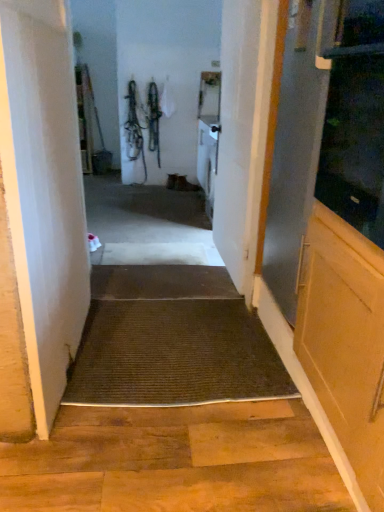
Image resolution: width=384 pixels, height=512 pixels. Find the location of `transparent glass screen door at right, placed as the second screen door when sorted from front to back`. transparent glass screen door at right, placed as the second screen door when sorted from front to back is located at coordinates (294, 156).

In order to click on brown textured mat at center, which is the second doormat in back-to-front order in this screenshot , I will do `click(174, 355)`.

Image resolution: width=384 pixels, height=512 pixels. What are the coordinates of `transparent glass screen door at right, placed as the second screen door when sorted from front to back` in the screenshot? It's located at click(x=294, y=156).

How far apart are brown textured mat at center, which is the second doormat in back-to-front order, and brown textured mat at center, placed as the 2th doormat when sorted from front to back?

The distance of brown textured mat at center, which is the second doormat in back-to-front order, from brown textured mat at center, placed as the 2th doormat when sorted from front to back, is 19.08 inches.

Considering the sizes of brown textured mat at center, which is the second doormat in back-to-front order, and brown textured mat at center, the 2th doormat positioned from the bottom, in the image, is brown textured mat at center, which is the second doormat in back-to-front order, bigger or smaller than brown textured mat at center, the 2th doormat positioned from the bottom,?

In the image, brown textured mat at center, which is the second doormat in back-to-front order, appears to be larger than brown textured mat at center, the 2th doormat positioned from the bottom.

Is brown textured mat at center, arranged as the first doormat when viewed from the front, facing towards brown textured mat at center, the 1th doormat in the top-to-bottom sequence?

No, brown textured mat at center, arranged as the first doormat when viewed from the front, is not aimed at brown textured mat at center, the 1th doormat in the top-to-bottom sequence.

Considering the positions of objects brown textured mat at center, the second doormat when ordered from top to bottom, and brown textured mat at center, the 2th doormat positioned from the bottom, in the image provided, who is behind, brown textured mat at center, the second doormat when ordered from top to bottom, or brown textured mat at center, the 2th doormat positioned from the bottom,?

brown textured mat at center, the 2th doormat positioned from the bottom, is further from the camera.

From the image's perspective, which one is positioned higher, transparent glass screen door at right, which is the second screen door from back to front, or brown textured mat at center, which ranks as the first doormat in bottom-to-top order?

From the image's view, transparent glass screen door at right, which is the second screen door from back to front, is above.

Considering the relative sizes of transparent glass screen door at right, the first screen door when ordered from front to back, and brown textured mat at center, which is the second doormat in back-to-front order, in the image provided, is transparent glass screen door at right, the first screen door when ordered from front to back, wider than brown textured mat at center, which is the second doormat in back-to-front order,?

Incorrect, the width of transparent glass screen door at right, the first screen door when ordered from front to back, does not surpass that of brown textured mat at center, which is the second doormat in back-to-front order.

Is transparent glass screen door at right, which is the second screen door from back to front, beside brown textured mat at center, which is the second doormat in back-to-front order?

No, transparent glass screen door at right, which is the second screen door from back to front, is not beside brown textured mat at center, which is the second doormat in back-to-front order.

Can you confirm if brown textured mat at center, the first doormat when ordered from back to front, is positioned to the right of transparent glass screen door at right, the first screen door when ordered from front to back?

In fact, brown textured mat at center, the first doormat when ordered from back to front, is to the left of transparent glass screen door at right, the first screen door when ordered from front to back.

Is brown textured mat at center, the 1th doormat in the top-to-bottom sequence, positioned far away from transparent glass screen door at right, the first screen door when ordered from front to back?

Yes, brown textured mat at center, the 1th doormat in the top-to-bottom sequence, and transparent glass screen door at right, the first screen door when ordered from front to back, are quite far apart.

From the image's perspective, is brown textured mat at center, placed as the 2th doormat when sorted from front to back, located above transparent glass screen door at right, which is the second screen door from back to front?

Incorrect, from the image's perspective, brown textured mat at center, placed as the 2th doormat when sorted from front to back, is lower than transparent glass screen door at right, which is the second screen door from back to front.

In the image, is brown textured mat at center, the first doormat when ordered from back to front, positioned in front of or behind transparent glass screen door at right, the first screen door when ordered from front to back?

Visually, brown textured mat at center, the first doormat when ordered from back to front, is located behind transparent glass screen door at right, the first screen door when ordered from front to back.

Where is `the 2nd door above the brown textured mat at center, placed as the 2th doormat when sorted from front to back (from the image's perspective)`? The height and width of the screenshot is (512, 384). the 2nd door above the brown textured mat at center, placed as the 2th doormat when sorted from front to back (from the image's perspective) is located at coordinates (238, 134).

From the image's perspective, does white wood door at center, acting as the second door starting from the left, appear lower than brown textured mat at center, the first doormat when ordered from back to front?

Incorrect, from the image's perspective, white wood door at center, acting as the second door starting from the left, is higher than brown textured mat at center, the first doormat when ordered from back to front.

Can you confirm if white wood door at center, acting as the second door starting from the left, is bigger than brown textured mat at center, the 2th doormat positioned from the bottom?

Correct, white wood door at center, acting as the second door starting from the left, is larger in size than brown textured mat at center, the 2th doormat positioned from the bottom.

Which of these two, white wood door at center, acting as the second door starting from the left, or brown textured mat at center, the 1th doormat in the top-to-bottom sequence, is thinner?

With smaller width is white wood door at center, acting as the second door starting from the left.

Does transparent glass screen door at right, arranged as the first screen door when viewed from the back, have a lesser width compared to white wood door at center, acting as the second door starting from the left?

No, transparent glass screen door at right, arranged as the first screen door when viewed from the back, is not thinner than white wood door at center, acting as the second door starting from the left.

What are the coordinates of `the 1st screen door counting from the right side of the white wood door at center, acting as the second door starting from the left` in the screenshot? It's located at (294, 156).

Would you say transparent glass screen door at right, placed as the second screen door when sorted from front to back, contains white wood door at center, acting as the second door starting from the left?

No.

Considering the positions of objects brown textured mat at center, the 2th doormat positioned from the bottom, and white matte door at center, the first door positioned from the left, in the image provided, who is more to the left, brown textured mat at center, the 2th doormat positioned from the bottom, or white matte door at center, the first door positioned from the left,?

white matte door at center, the first door positioned from the left, is more to the left.

Is brown textured mat at center, the first doormat when ordered from back to front, touching white matte door at center, which is counted as the 2th door, starting from the right?

No, brown textured mat at center, the first doormat when ordered from back to front, is not beside white matte door at center, which is counted as the 2th door, starting from the right.

In the scene shown: Considering the sizes of brown textured mat at center, the 1th doormat in the top-to-bottom sequence, and white matte door at center, the first door positioned from the left, in the image, is brown textured mat at center, the 1th doormat in the top-to-bottom sequence, bigger or smaller than white matte door at center, the first door positioned from the left,?

brown textured mat at center, the 1th doormat in the top-to-bottom sequence, is smaller than white matte door at center, the first door positioned from the left.

In order to click on door that is the 1st one above the brown textured mat at center, placed as the 2th doormat when sorted from front to back (from a real-world perspective) in this screenshot , I will do `click(40, 212)`.

From the picture: Which of these two, brown textured mat at center, which is the second doormat in back-to-front order, or transparent glass screen door at right, the first screen door when ordered from front to back, is thinner?

transparent glass screen door at right, the first screen door when ordered from front to back, is thinner.

Which is in front, point (87, 365) or point (354, 212)?

The point (354, 212) is closer.

Measure the distance from brown textured mat at center, which ranks as the first doormat in bottom-to-top order, to transparent glass screen door at right, the first screen door when ordered from front to back.

A distance of 1.08 meters exists between brown textured mat at center, which ranks as the first doormat in bottom-to-top order, and transparent glass screen door at right, the first screen door when ordered from front to back.

What's the angular difference between brown textured mat at center, which ranks as the first doormat in bottom-to-top order, and transparent glass screen door at right, the first screen door when ordered from front to back,'s facing directions?

The facing directions of brown textured mat at center, which ranks as the first doormat in bottom-to-top order, and transparent glass screen door at right, the first screen door when ordered from front to back, are 90.5 degrees apart.

I want to click on doormat above the brown textured mat at center, arranged as the first doormat when viewed from the front (from the image's perspective), so click(161, 282).

This screenshot has height=512, width=384. What are the coordinates of `the 1st doormat to the left when counting from the transparent glass screen door at right, which is the second screen door from back to front` in the screenshot? It's located at (174, 355).

When comparing their distances from brown textured mat at center, the first doormat when ordered from back to front, does transparent glass screen door at right, arranged as the first screen door when viewed from the back, or transparent glass screen door at right, which is the second screen door from back to front, seem closer?

Among the two, transparent glass screen door at right, arranged as the first screen door when viewed from the back, is located nearer to brown textured mat at center, the first doormat when ordered from back to front.

Which object lies further to the anchor point white wood door at center, which ranks as the 1th door in right-to-left order, transparent glass screen door at right, placed as the second screen door when sorted from front to back, or brown textured mat at center, which is the second doormat in back-to-front order?

Based on the image, brown textured mat at center, which is the second doormat in back-to-front order, appears to be further to white wood door at center, which ranks as the 1th door in right-to-left order.

Considering their positions, is brown textured mat at center, the first doormat when ordered from back to front, positioned further to white wood door at center, which ranks as the 1th door in right-to-left order, than transparent glass screen door at right, which is the second screen door from back to front?

transparent glass screen door at right, which is the second screen door from back to front, is further to white wood door at center, which ranks as the 1th door in right-to-left order.

Estimate the real-world distances between objects in this image. Which object is further from white wood door at center, acting as the second door starting from the left, transparent glass screen door at right, arranged as the first screen door when viewed from the back, or transparent glass screen door at right, which is the second screen door from back to front?

transparent glass screen door at right, which is the second screen door from back to front, is positioned further to the anchor white wood door at center, acting as the second door starting from the left.

Estimate the real-world distances between objects in this image. Which object is closer to transparent glass screen door at right, which is the second screen door from back to front, brown textured mat at center, the 1th doormat in the top-to-bottom sequence, or transparent glass screen door at right, arranged as the first screen door when viewed from the back?

The object closer to transparent glass screen door at right, which is the second screen door from back to front, is transparent glass screen door at right, arranged as the first screen door when viewed from the back.

Estimate the real-world distances between objects in this image. Which object is further from white matte door at center, the first door positioned from the left, brown textured mat at center, the 2th doormat positioned from the bottom, or transparent glass screen door at right, placed as the second screen door when sorted from front to back?

transparent glass screen door at right, placed as the second screen door when sorted from front to back, is positioned further to the anchor white matte door at center, the first door positioned from the left.

From the picture: Based on their spatial positions, is transparent glass screen door at right, the first screen door when ordered from front to back, or white matte door at center, which is counted as the 2th door, starting from the right, further from brown textured mat at center, the second doormat when ordered from top to bottom?

transparent glass screen door at right, the first screen door when ordered from front to back, lies further to brown textured mat at center, the second doormat when ordered from top to bottom, than the other object.

Estimate the real-world distances between objects in this image. Which object is further from transparent glass screen door at right, the first screen door when ordered from front to back, white matte door at center, the first door positioned from the left, or transparent glass screen door at right, placed as the second screen door when sorted from front to back?

The object further to transparent glass screen door at right, the first screen door when ordered from front to back, is white matte door at center, the first door positioned from the left.

What are the coordinates of `doormat between transparent glass screen door at right, the first screen door when ordered from front to back, and brown textured mat at center, placed as the 2th doormat when sorted from front to back, from front to back` in the screenshot? It's located at (174, 355).

Where is `door between transparent glass screen door at right, arranged as the first screen door when viewed from the back, and brown textured mat at center, the 1th doormat in the top-to-bottom sequence, in the front-back direction`? The width and height of the screenshot is (384, 512). door between transparent glass screen door at right, arranged as the first screen door when viewed from the back, and brown textured mat at center, the 1th doormat in the top-to-bottom sequence, in the front-back direction is located at coordinates (238, 134).

This screenshot has height=512, width=384. Identify the location of screen door between white matte door at center, which is counted as the 2th door, starting from the right, and brown textured mat at center, placed as the 2th doormat when sorted from front to back, in the front-back direction. (294, 156).

This screenshot has width=384, height=512. What are the coordinates of `screen door between transparent glass screen door at right, the first screen door when ordered from front to back, and white wood door at center, acting as the second door starting from the left, along the z-axis` in the screenshot? It's located at (294, 156).